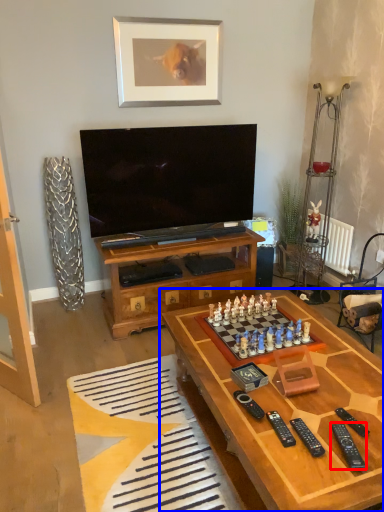
Question: Among these objects, which one is nearest to the camera, remote (highlighted by a red box) or table (highlighted by a blue box)?

Choices:
 (A) remote
 (B) table

Answer: (B)